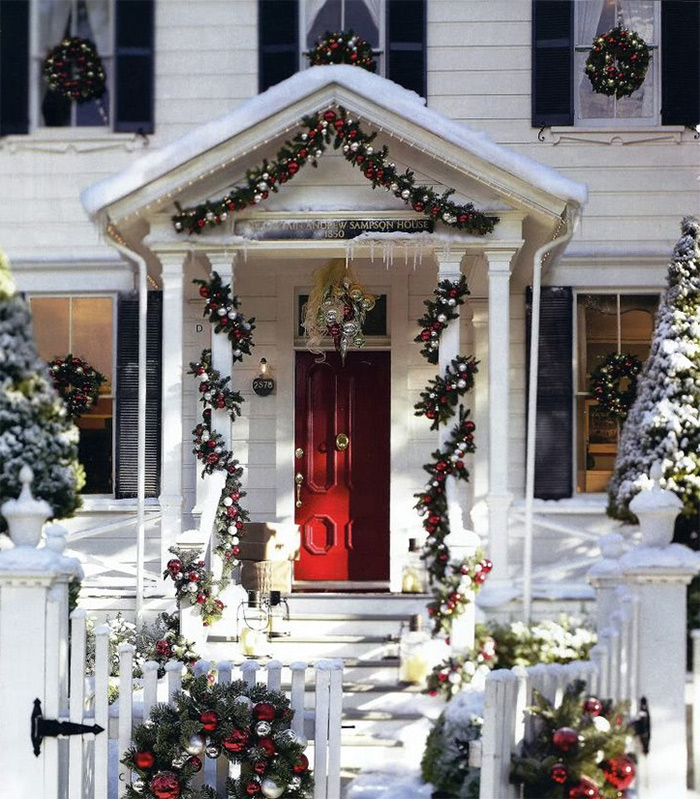
This screenshot has width=700, height=799. Identify the location of stairs. (391, 702), (378, 648).